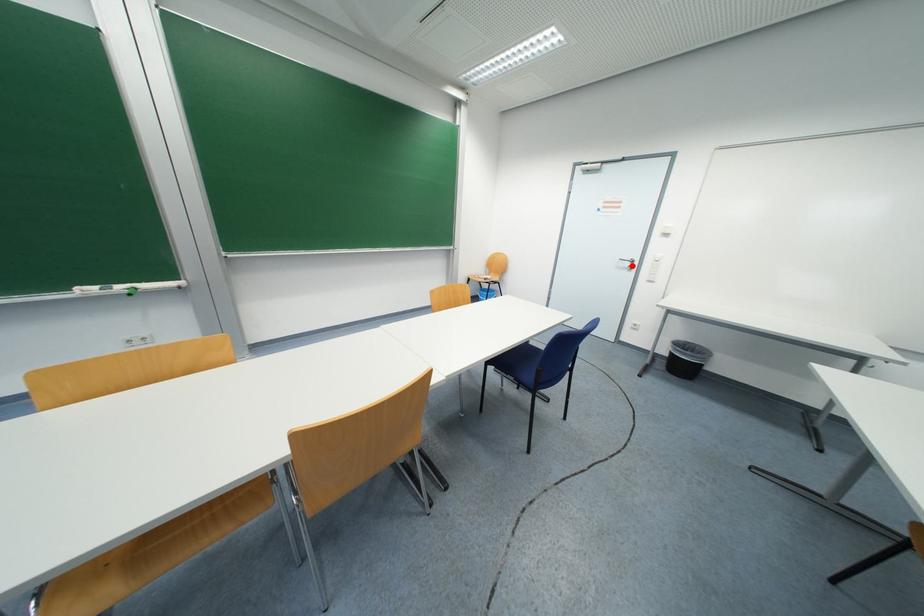
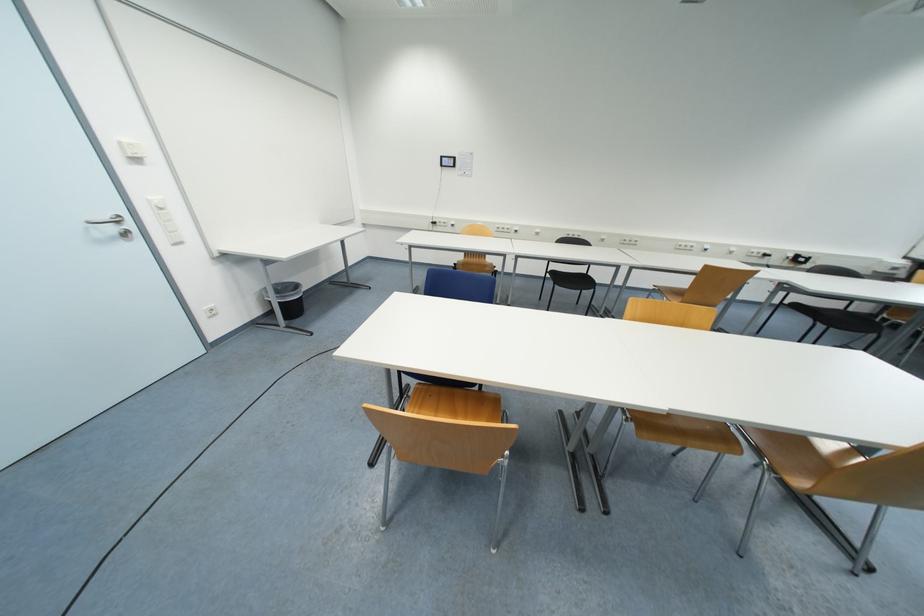
In the second image, find the point that corresponds to the highlighted location in the first image.

(117, 230)